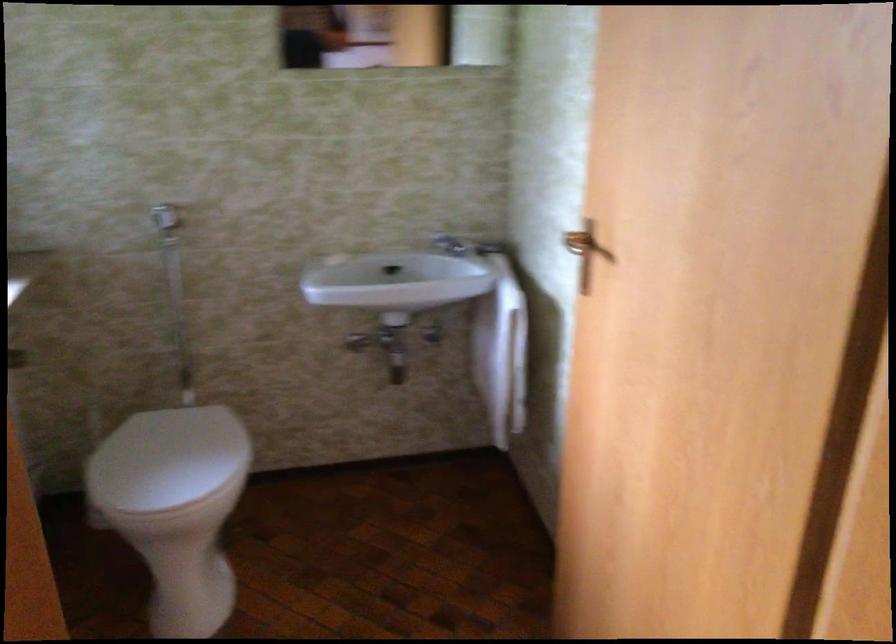
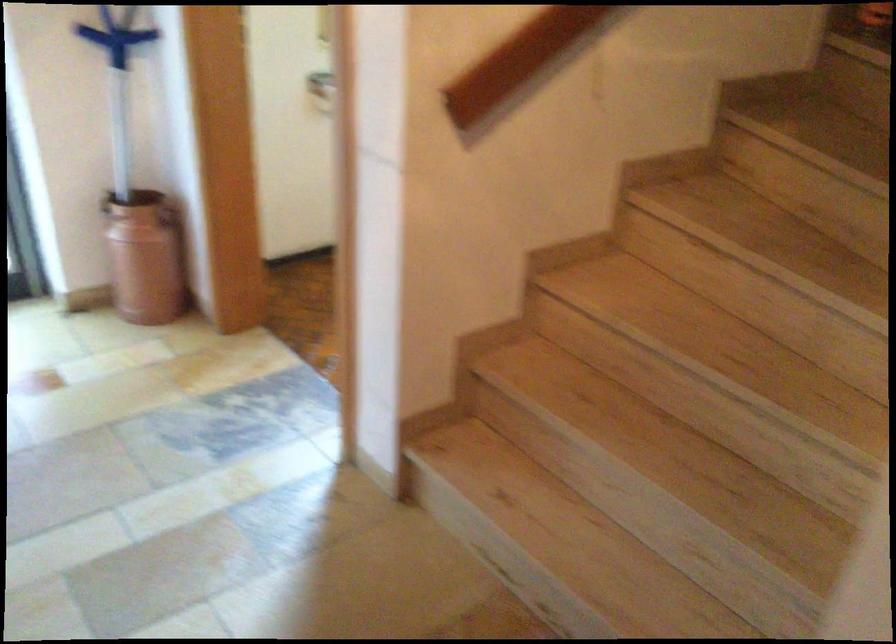
Question: I am providing you with two images of the same scene from different viewpoints. After the viewpoint changes to image2, which objects are now occluded?

Choices:
 (A) red sofa cushion
 (B) white toilet lid
 (C) blue cleaning tool
 (D) container handle

Answer: (B)